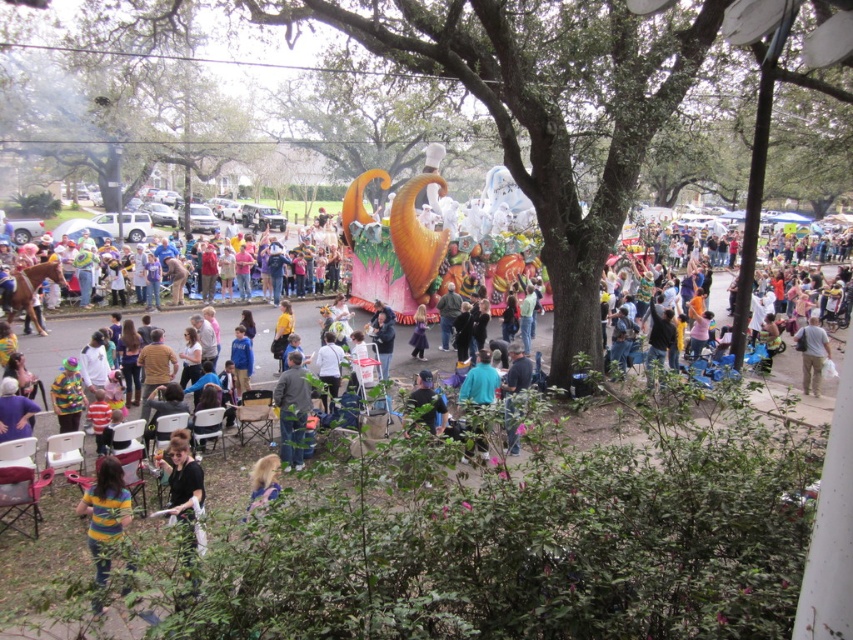
Who is positioned more to the left, striped shirt at lower left or gray cotton shirt at lower right?

Positioned to the left is striped shirt at lower left.

In order to click on striped shirt at lower left in this screenshot , I will do `click(105, 513)`.

Can you confirm if denim jacket at center is positioned above blonde hair at lower left?

Yes, denim jacket at center is above blonde hair at lower left.

Does denim jacket at center have a lesser height compared to blonde hair at lower left?

Correct, denim jacket at center is not as tall as blonde hair at lower left.

Does point (305, 381) lie in front of point (263, 504)?

That is False.

The width and height of the screenshot is (853, 640). I want to click on denim jacket at center, so click(x=292, y=410).

Is black shirt at lower left taller than denim jacket at center?

Yes, black shirt at lower left is taller than denim jacket at center.

Is black shirt at lower left wider than denim jacket at center?

Indeed, black shirt at lower left has a greater width compared to denim jacket at center.

Find the location of a particular element. The width and height of the screenshot is (853, 640). black shirt at lower left is located at coordinates (183, 481).

Where is `black shirt at lower left`? Image resolution: width=853 pixels, height=640 pixels. black shirt at lower left is located at coordinates (183, 481).